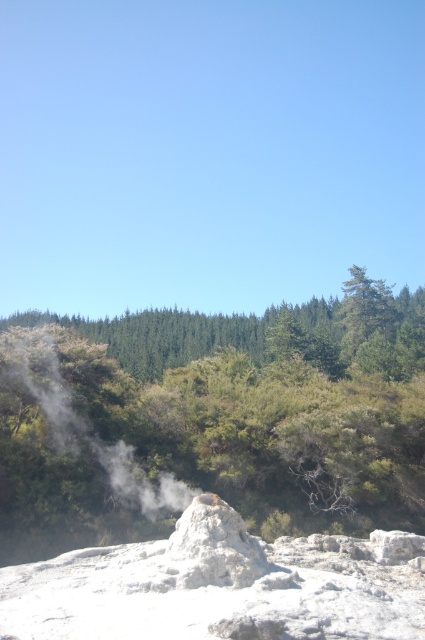
Question: Can you confirm if white vapor at center is bigger than white porous rock at center?

Choices:
 (A) yes
 (B) no

Answer: (A)

Question: Which of the following is the farthest from the observer?

Choices:
 (A) white vapor at center
 (B) green leafy forest at center

Answer: (A)

Question: Which point is closer to the camera taking this photo?

Choices:
 (A) (393, 401)
 (B) (3, 420)
 (C) (257, 547)

Answer: (C)

Question: Considering the relative positions of green leafy forest at center and white porous rock at center in the image provided, where is green leafy forest at center located with respect to white porous rock at center?

Choices:
 (A) right
 (B) left

Answer: (B)

Question: Which point is farther to the camera?

Choices:
 (A) (95, 440)
 (B) (303, 310)
 (C) (234, 518)

Answer: (B)

Question: Can you confirm if white vapor at center is bigger than white porous rock at center?

Choices:
 (A) yes
 (B) no

Answer: (A)